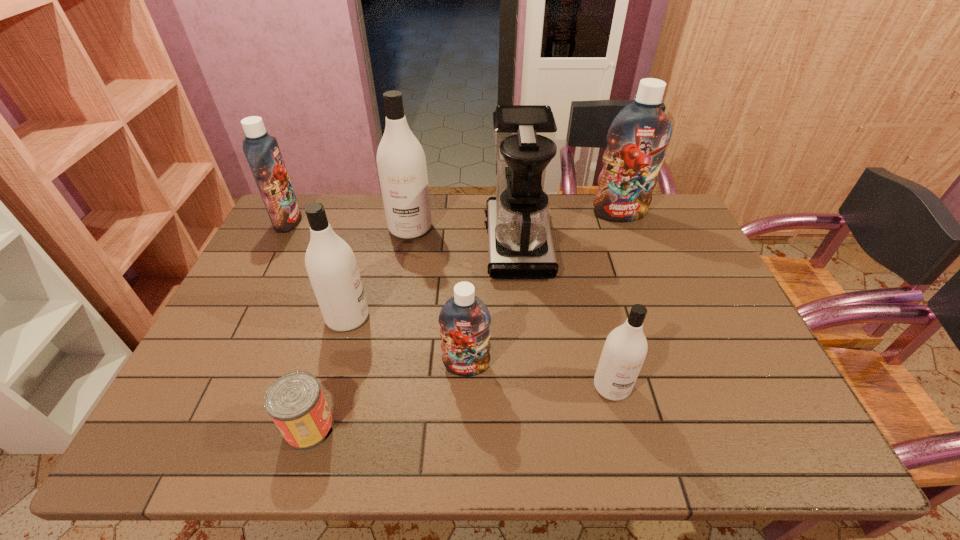
Where is `empty space that is in between the second blue shampoo from right to left and the nearest object`? The image size is (960, 540). empty space that is in between the second blue shampoo from right to left and the nearest object is located at coordinates (388, 396).

I want to click on object that ranks as the seventh closest to the smallest white shampoo, so click(x=262, y=152).

In order to click on object that stands as the fourth closest to the smallest white shampoo in this screenshot , I will do `click(295, 402)`.

You are a GUI agent. You are given a task and a screenshot of the screen. Output one action in this format:
    pyautogui.click(x=<x>, y=<y>)
    Task: Click on the shampoo that stands as the closest to the nearest object
    This screenshot has width=960, height=540.
    Given the screenshot: What is the action you would take?
    pyautogui.click(x=330, y=262)

Locate an element on the screen. shampoo that is the sixth closest one to the shortest object is located at coordinates (638, 136).

You are a GUI agent. You are given a task and a screenshot of the screen. Output one action in this format:
    pyautogui.click(x=<x>, y=<y>)
    Task: Click on the white shampoo object that ranks as the third closest to the smallest blue shampoo
    This screenshot has width=960, height=540.
    Given the screenshot: What is the action you would take?
    pyautogui.click(x=401, y=163)

Locate an element on the screen. white shampoo that is the closest to the farthest white shampoo is located at coordinates (330, 262).

Identify which blue shampoo is located as the nearest to the shortest object. Please provide its 2D coordinates. Your answer should be formatted as a tuple, i.e. [(x, y)], where the tuple contains the x and y coordinates of a point satisfying the conditions above.

[(464, 319)]

Identify which blue shampoo is the second nearest to the shortest object. Please provide its 2D coordinates. Your answer should be formatted as a tuple, i.e. [(x, y)], where the tuple contains the x and y coordinates of a point satisfying the conditions above.

[(262, 152)]